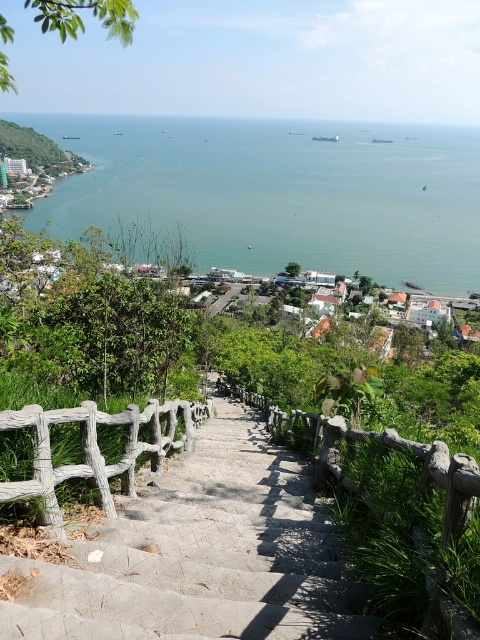
Question: Which of these objects is positioned farthest from the weathered wood fence at lower left?

Choices:
 (A) concrete stairs at center
 (B) wooden at center

Answer: (B)

Question: Does concrete stairs at center appear on the right side of wooden at center?

Choices:
 (A) yes
 (B) no

Answer: (B)

Question: Among these objects, which one is farthest from the camera?

Choices:
 (A) wooden at center
 (B) concrete stairs at center

Answer: (B)

Question: Does green water at center appear on the right side of wooden at center?

Choices:
 (A) no
 (B) yes

Answer: (A)

Question: Is green water at center thinner than weathered wood fence at lower left?

Choices:
 (A) no
 (B) yes

Answer: (A)

Question: Which object is the farthest from the concrete stairs at center?

Choices:
 (A) green water at center
 (B) weathered wood fence at lower left
 (C) wooden at center

Answer: (A)